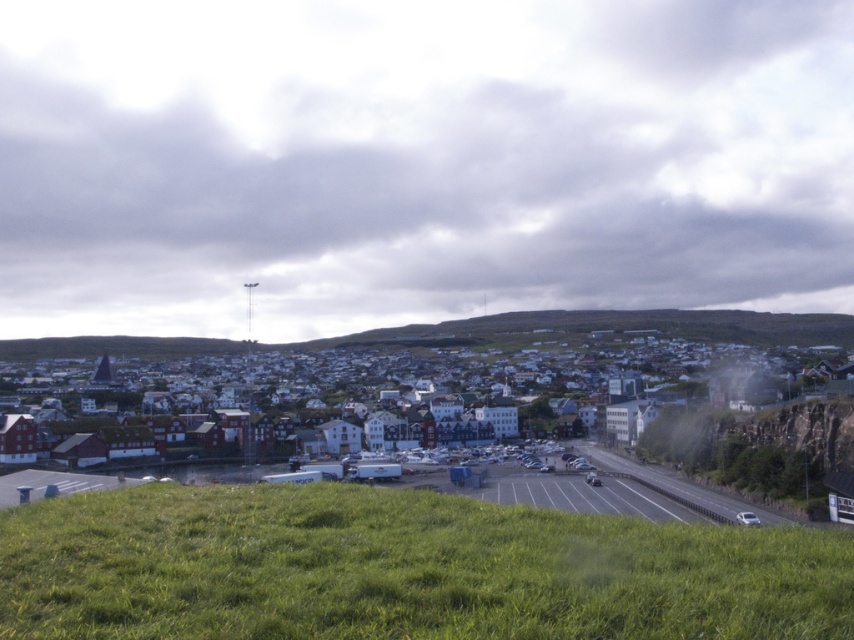
Question: Is green grassy field at lower center smaller than white matte buildings at center?

Choices:
 (A) yes
 (B) no

Answer: (A)

Question: Which object appears farthest from the camera in this image?

Choices:
 (A) white matte buildings at center
 (B) green grassy field at lower center

Answer: (A)

Question: Is green grassy field at lower center to the left of white matte buildings at center from the viewer's perspective?

Choices:
 (A) no
 (B) yes

Answer: (B)

Question: Can you confirm if green grassy field at lower center is wider than white matte buildings at center?

Choices:
 (A) no
 (B) yes

Answer: (A)

Question: Which object is farther from the camera taking this photo?

Choices:
 (A) green grassy field at lower center
 (B) white matte buildings at center

Answer: (B)